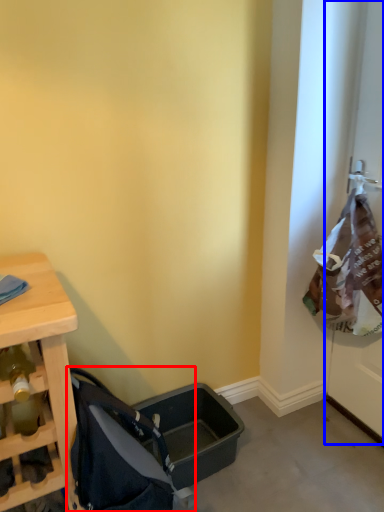
Question: Which of the following is the closest to the observer, baby carriage (highlighted by a red box) or screen door (highlighted by a blue box)?

Choices:
 (A) baby carriage
 (B) screen door

Answer: (A)